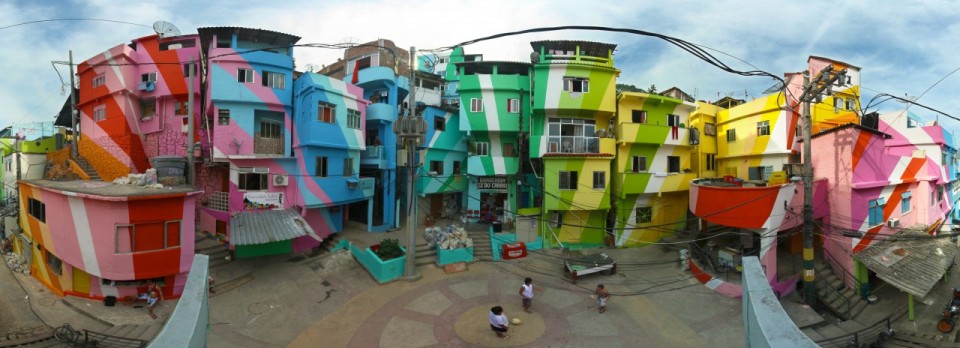
Identify the location of picture. The width and height of the screenshot is (960, 348). (535, 135).